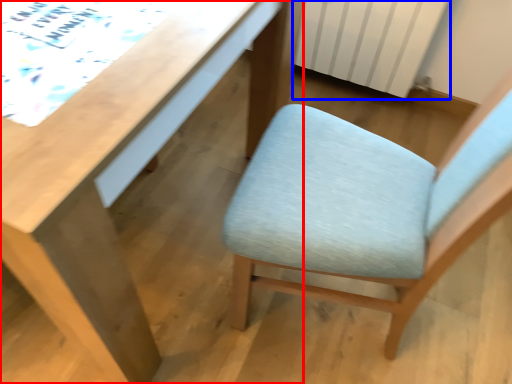
Question: Which object appears farthest to the camera in this image, desk (highlighted by a red box) or radiator (highlighted by a blue box)?

Choices:
 (A) desk
 (B) radiator

Answer: (B)